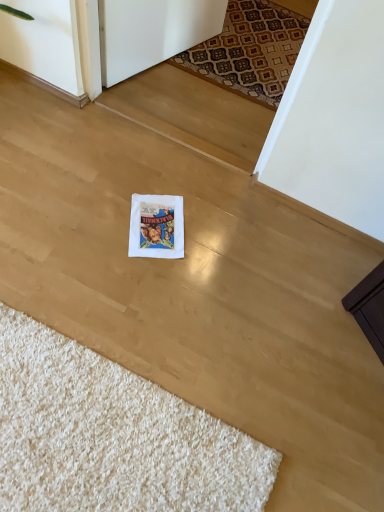
At what (x,y) coordinates should I click in order to perform the action: click on free region under white paper postcard at center (from a real-world perspective). Please return your answer as a coordinate pair (x, y). This screenshot has width=384, height=512. Looking at the image, I should click on (163, 228).